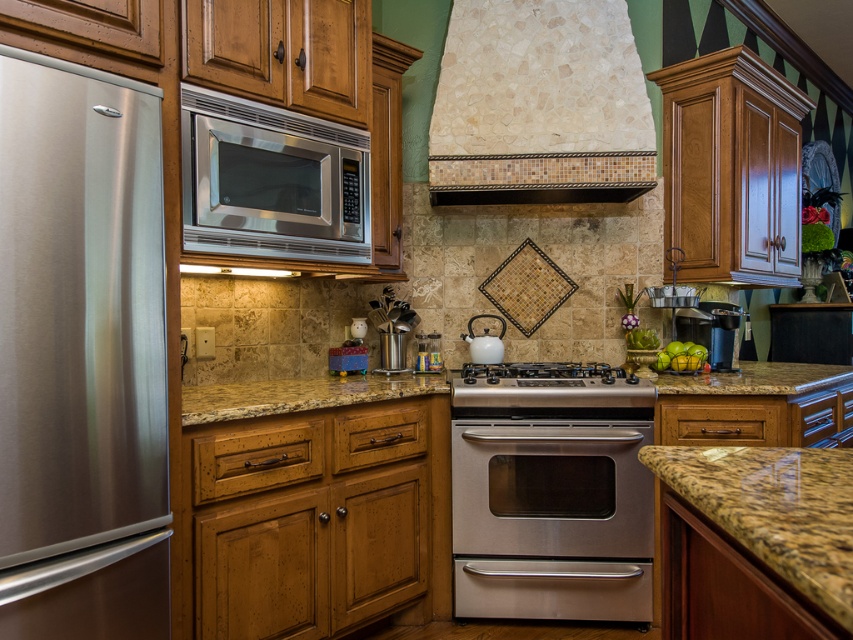
You are a chef who wants to install a new exhaust hood in the kitchen. The current exhaust hood is located at point [540,106]. Can you confirm if the mosaic tile exhaust hood at upper center is the one you need to replace?

The mosaic tile exhaust hood at upper center is represented by point [540,106], so yes, that is the exhaust hood you need to replace.

You are a chef preparing to install a new stove in the kitchen. The stove needs to be placed between the mosaic tile exhaust hood at upper center and the brown granite countertop at lower right. Based on their positions, where should the stove be positioned relative to these two objects?

The stove should be placed to the right of the mosaic tile exhaust hood at upper center and to the left of the brown granite countertop at lower right since the mosaic tile exhaust hood at upper center is to the left of the brown granite countertop at lower right.